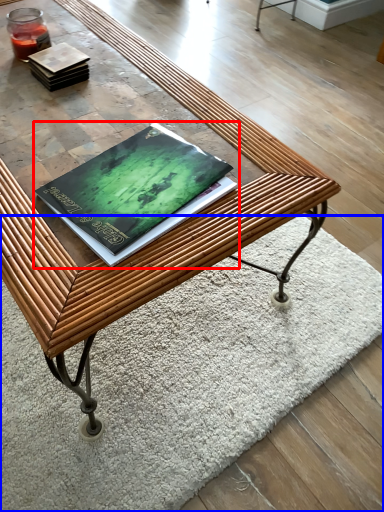
Question: Which point is further to the camera, book (highlighted by a red box) or mat (highlighted by a blue box)?

Choices:
 (A) book
 (B) mat

Answer: (B)